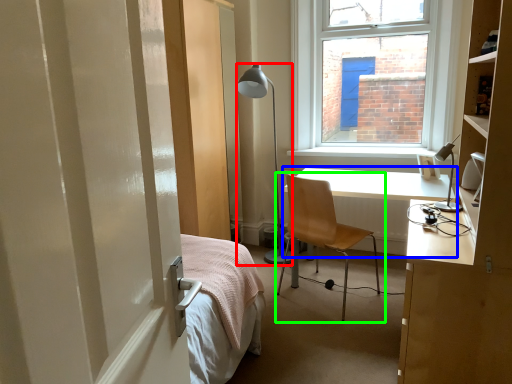
Question: Based on their relative distances, which object is nearer to lamp (highlighted by a red box)? Choose from desk (highlighted by a blue box) and chair (highlighted by a green box).

Choices:
 (A) desk
 (B) chair

Answer: (A)